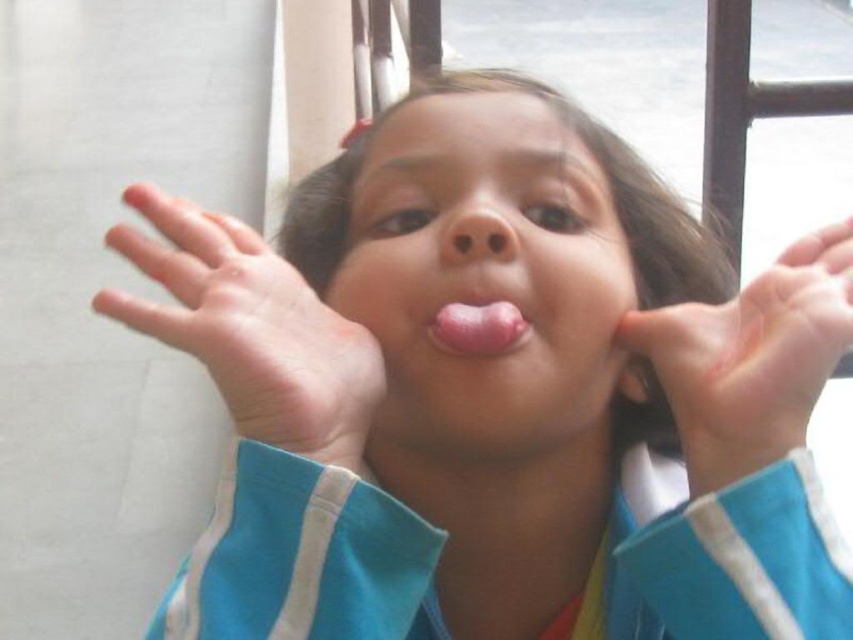
Does smooth skin face at center have a greater width compared to pink matte nose at center?

Yes.

Is smooth skin face at center positioned in front of pink matte nose at center?

Yes, smooth skin face at center is in front of pink matte nose at center.

Between point (532, 136) and point (490, 236), which one is positioned behind?

Point (532, 136)

I want to click on smooth skin face at center, so click(486, 275).

Is smooth skin face at center below pale skin hand at center?

No.

Does smooth skin face at center have a lesser width compared to pale skin hand at center?

No.

Who is more forward, (492, 412) or (334, 396)?

Point (334, 396)

The image size is (853, 640). Identify the location of smooth skin face at center. tap(486, 275).

Is point (215, 250) positioned in front of point (450, 212)?

Yes, point (215, 250) is in front of point (450, 212).

Who is more distant from viewer, (321, 404) or (480, 216)?

Point (480, 216)

This screenshot has width=853, height=640. What are the coordinates of `pale skin hand at center` in the screenshot? It's located at (250, 330).